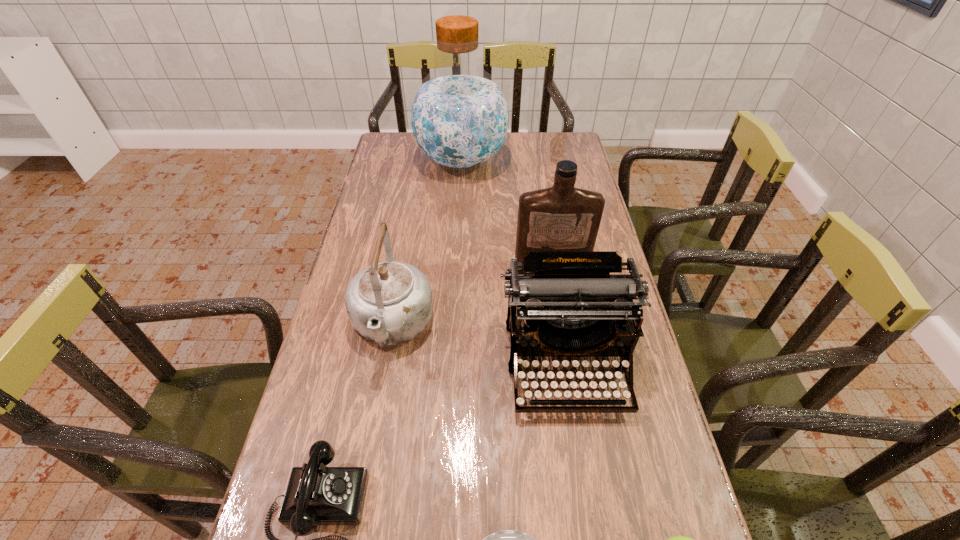
Image resolution: width=960 pixels, height=540 pixels. Identify the location of the tallest object. (459, 116).

The width and height of the screenshot is (960, 540). I want to click on water jug, so click(x=459, y=116).

Where is `liquor`? The width and height of the screenshot is (960, 540). liquor is located at coordinates (561, 218).

Where is `the second tallest object`? the second tallest object is located at coordinates (561, 218).

You are a GUI agent. You are given a task and a screenshot of the screen. Output one action in this format:
    pyautogui.click(x=<x>, y=<y>)
    Task: Click on the kettle
    This screenshot has height=540, width=960.
    Given the screenshot: What is the action you would take?
    pyautogui.click(x=388, y=303)

Identify the location of typewriter. (572, 306).

Identify the location of vacant area situated 0.280m on the right of the farthest object. (578, 161).

At what (x,y) coordinates should I click in order to perform the action: click on vacant space located on the label side of the second farthest object. Please return your answer as a coordinate pair (x, y). This screenshot has height=540, width=960. Looking at the image, I should click on (571, 400).

Where is `vacant space located 0.230m at the spout of the kettle`? vacant space located 0.230m at the spout of the kettle is located at coordinates (368, 463).

Where is `vacant space located on the typing side of the typewriter`? The image size is (960, 540). vacant space located on the typing side of the typewriter is located at coordinates (585, 483).